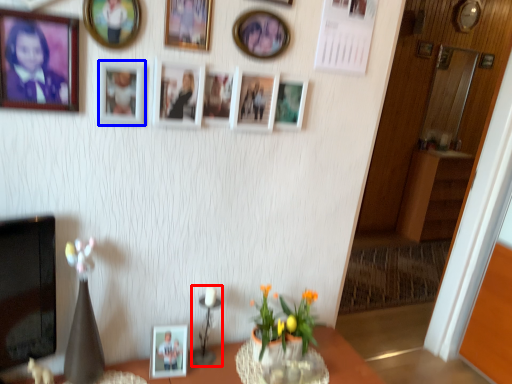
Question: Among these objects, which one is farthest to the camera, candle holder (highlighted by a red box) or picture frame (highlighted by a blue box)?

Choices:
 (A) candle holder
 (B) picture frame

Answer: (A)